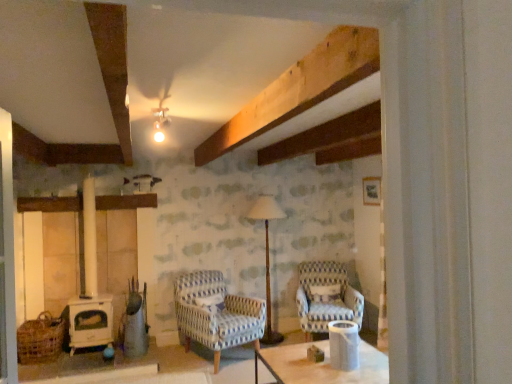
Question: From a real-world perspective, does blue and white striped fabric armchair at center-right, which appears as the 1th chair when viewed from the right, sit lower than wooden floor lamp at center?

Choices:
 (A) yes
 (B) no

Answer: (A)

Question: Considering the relative sizes of blue and white striped fabric armchair at center-right, positioned as the 2th chair in left-to-right order, and wooden floor lamp at center in the image provided, is blue and white striped fabric armchair at center-right, positioned as the 2th chair in left-to-right order, thinner than wooden floor lamp at center?

Choices:
 (A) yes
 (B) no

Answer: (B)

Question: Does blue and white striped fabric armchair at center-right, which appears as the 1th chair when viewed from the right, appear on the left side of wooden floor lamp at center?

Choices:
 (A) no
 (B) yes

Answer: (A)

Question: Considering the relative positions of blue and white striped fabric armchair at center-right, positioned as the 2th chair in left-to-right order, and wooden floor lamp at center in the image provided, is blue and white striped fabric armchair at center-right, positioned as the 2th chair in left-to-right order, to the right of wooden floor lamp at center from the viewer's perspective?

Choices:
 (A) yes
 (B) no

Answer: (A)

Question: From a real-world perspective, is blue and white striped fabric armchair at center-right, positioned as the 2th chair in left-to-right order, on top of wooden floor lamp at center?

Choices:
 (A) yes
 (B) no

Answer: (B)

Question: Is blue and white striped fabric armchair at center-right, positioned as the 2th chair in left-to-right order, completely or partially outside of wooden floor lamp at center?

Choices:
 (A) no
 (B) yes

Answer: (B)

Question: Could you tell me if blue and white striped fabric armchair at center-right, positioned as the 2th chair in left-to-right order, is turned towards blue and white woven fabric armchair at center, acting as the 1th chair starting from the left?

Choices:
 (A) no
 (B) yes

Answer: (A)

Question: Considering the relative sizes of blue and white striped fabric armchair at center-right, positioned as the 2th chair in left-to-right order, and blue and white woven fabric armchair at center, acting as the 1th chair starting from the left, in the image provided, is blue and white striped fabric armchair at center-right, positioned as the 2th chair in left-to-right order, bigger than blue and white woven fabric armchair at center, acting as the 1th chair starting from the left,?

Choices:
 (A) no
 (B) yes

Answer: (A)

Question: Is blue and white striped fabric armchair at center-right, which appears as the 1th chair when viewed from the right, at the right side of blue and white woven fabric armchair at center, acting as the 1th chair starting from the left?

Choices:
 (A) yes
 (B) no

Answer: (A)

Question: From the image's perspective, does blue and white striped fabric armchair at center-right, which appears as the 1th chair when viewed from the right, appear higher than blue and white woven fabric armchair at center, acting as the 1th chair starting from the left?

Choices:
 (A) no
 (B) yes

Answer: (B)

Question: Is blue and white striped fabric armchair at center-right, which appears as the 1th chair when viewed from the right, thinner than blue and white woven fabric armchair at center, which ranks as the 2th chair in right-to-left order?

Choices:
 (A) no
 (B) yes

Answer: (B)

Question: Can you confirm if blue and white striped fabric armchair at center-right, positioned as the 2th chair in left-to-right order, is smaller than blue and white woven fabric armchair at center, acting as the 1th chair starting from the left?

Choices:
 (A) no
 (B) yes

Answer: (B)

Question: Considering the relative positions of blue and white woven fabric armchair at center, acting as the 1th chair starting from the left, and woven brown basket at lower left in the image provided, is blue and white woven fabric armchair at center, acting as the 1th chair starting from the left, in front of woven brown basket at lower left?

Choices:
 (A) no
 (B) yes

Answer: (A)